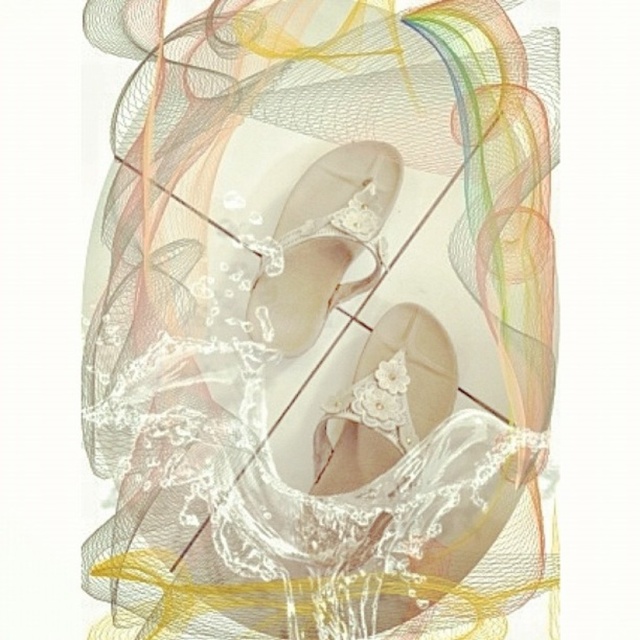
Question: In this image, where is pearl white satin sandal at center located relative to pearl white lace sandal at center?

Choices:
 (A) above
 (B) below

Answer: (A)

Question: Is pearl white satin sandal at center thinner than pearl white lace sandal at center?

Choices:
 (A) no
 (B) yes

Answer: (A)

Question: Which point is closer to the camera?

Choices:
 (A) (396, 333)
 (B) (305, 262)

Answer: (A)

Question: Is pearl white satin sandal at center thinner than pearl white lace sandal at center?

Choices:
 (A) no
 (B) yes

Answer: (A)

Question: Which object appears farthest from the camera in this image?

Choices:
 (A) pearl white lace sandal at center
 (B) pearl white satin sandal at center

Answer: (B)